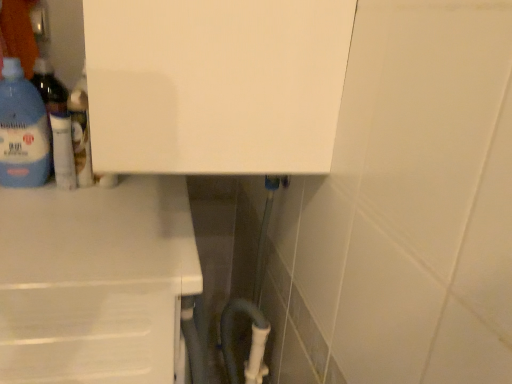
Question: Relative to white matte counter at lower left, is white glossy lotion at upper left, the 2th bottle when ordered from left to right, in front or behind?

Choices:
 (A) behind
 (B) front

Answer: (A)

Question: In the image, is white glossy lotion at upper left, marked as the 1th bottle in a right-to-left arrangement, on the left side or the right side of white matte counter at lower left?

Choices:
 (A) left
 (B) right

Answer: (B)

Question: Which object is positioned farthest from the translucent plastic bottle at left, which appears as the 1th bottle when viewed from the left?

Choices:
 (A) white matte counter at lower left
 (B) white glossy lotion at upper left, the 2th bottle when ordered from left to right

Answer: (A)

Question: Which object is the farthest from the translucent plastic bottle at left, the 2th bottle positioned from the right?

Choices:
 (A) white glossy lotion at upper left, the 2th bottle when ordered from left to right
 (B) white matte counter at lower left

Answer: (B)